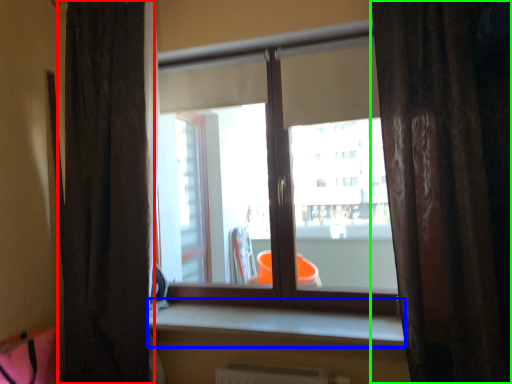
Question: Which object is positioned farthest from curtain (highlighted by a red box)? Select from window sill (highlighted by a blue box) and curtain (highlighted by a green box).

Choices:
 (A) window sill
 (B) curtain

Answer: (B)